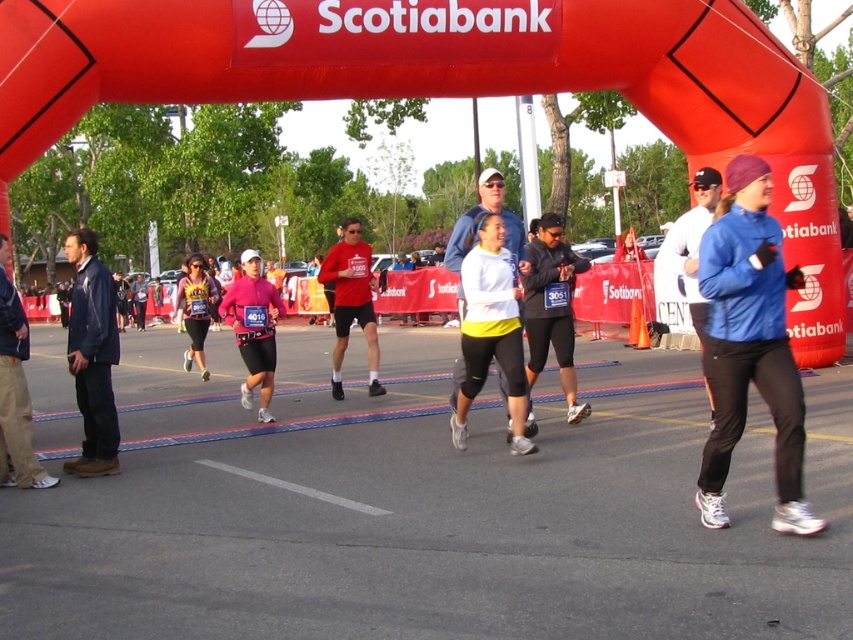
You are a photographer at the marathon event. You need to capture a photo of the white matte running top at center and the matte pink leggings at center. Which one will appear larger in the photo?

The white matte running top at center will appear larger in the photo because it is much taller than the matte pink leggings at center.

You are a photographer at the marathon event. You notice two runners wearing a blue matte jacket at center and a white matte running top at center. Which runner is positioned higher in the image?

The blue matte jacket at center is above the white matte running top at center, so the runner wearing the blue matte jacket at center is positioned higher in the image.

You are a runner in the marathon and you see the point at coordinates point [746,157]. If you are currently 5 meters away from it, can you reach it in one stride?

The point [746,157] is 4.92 meters from viewer. Since you are currently 5 meters away from it, you are almost there and can reach it in one stride.